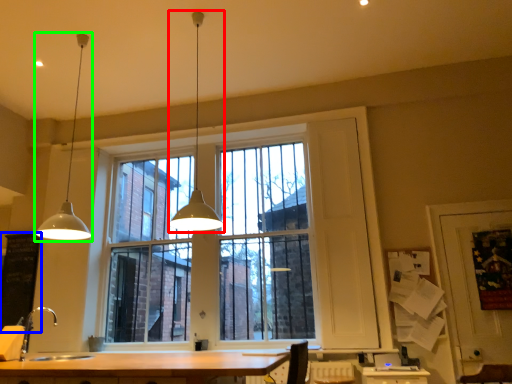
Question: Which is farther away from lamp (highlighted by a red box)? bulletin board (highlighted by a blue box) or lamp (highlighted by a green box)?

Choices:
 (A) bulletin board
 (B) lamp

Answer: (A)